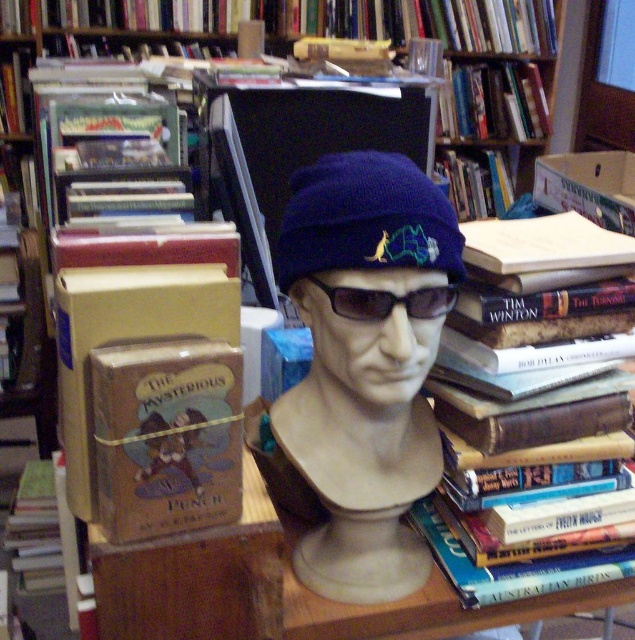
Question: Among these points, which one is farthest from the camera?

Choices:
 (A) (358, 268)
 (B) (345, 316)

Answer: (B)

Question: Is blue knitted hat at center above black plastic goggles at center?

Choices:
 (A) yes
 (B) no

Answer: (B)

Question: Is blue knitted hat at center to the left of hardcover book at center from the viewer's perspective?

Choices:
 (A) no
 (B) yes

Answer: (B)

Question: Considering the relative positions of blue knitted hat at center and navy blue knit beanie at center in the image provided, where is blue knitted hat at center located with respect to navy blue knit beanie at center?

Choices:
 (A) above
 (B) below

Answer: (B)

Question: Which object is the farthest from the hardcover book at center?

Choices:
 (A) black plastic goggles at center
 (B) navy blue knit beanie at center
 (C) blue knitted hat at center

Answer: (A)

Question: Which object is farther from the camera taking this photo?

Choices:
 (A) hardcover book at center
 (B) blue knitted hat at center

Answer: (A)